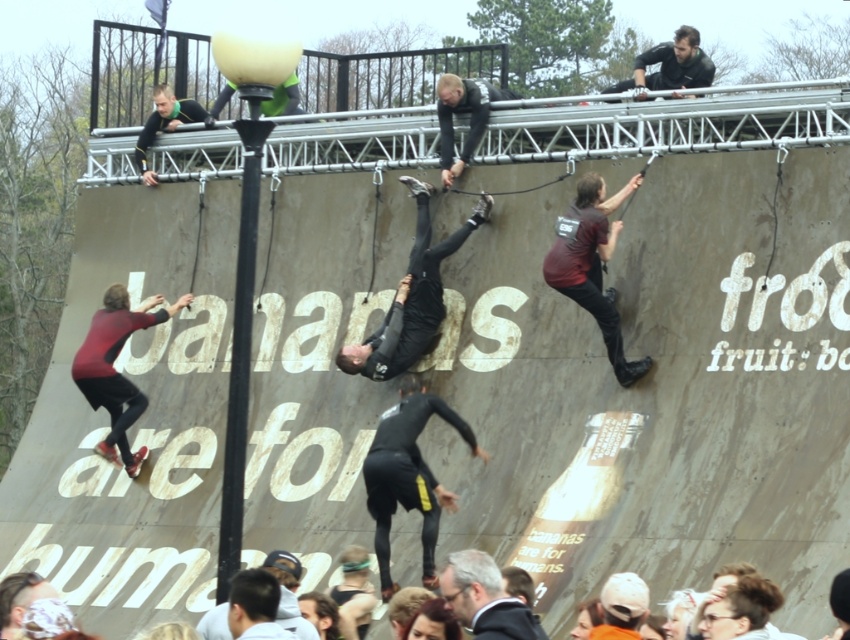
Question: Can you confirm if dark gray fabric at upper center is positioned to the right of dark brown leather jacket at lower center?

Choices:
 (A) no
 (B) yes

Answer: (B)

Question: Which is nearer to the black wetsuit at center?

Choices:
 (A) black matte skateboarder at center
 (B) dark gray fabric at upper center

Answer: (A)

Question: Which object appears farthest from the camera in this image?

Choices:
 (A) dark gray suit at lower center
 (B) white matte baseball cap at lower center

Answer: (B)

Question: Observing the image, what is the correct spatial positioning of black wetsuit at center in reference to dark gray suit at lower center?

Choices:
 (A) above
 (B) below

Answer: (A)

Question: Where is black wetsuit at center located in relation to white matte baseball cap at lower center in the image?

Choices:
 (A) below
 (B) above

Answer: (B)

Question: Which of the following is the closest to the observer?

Choices:
 (A) dark brown leather jacket at lower center
 (B) matte red skateboard at lower left

Answer: (A)